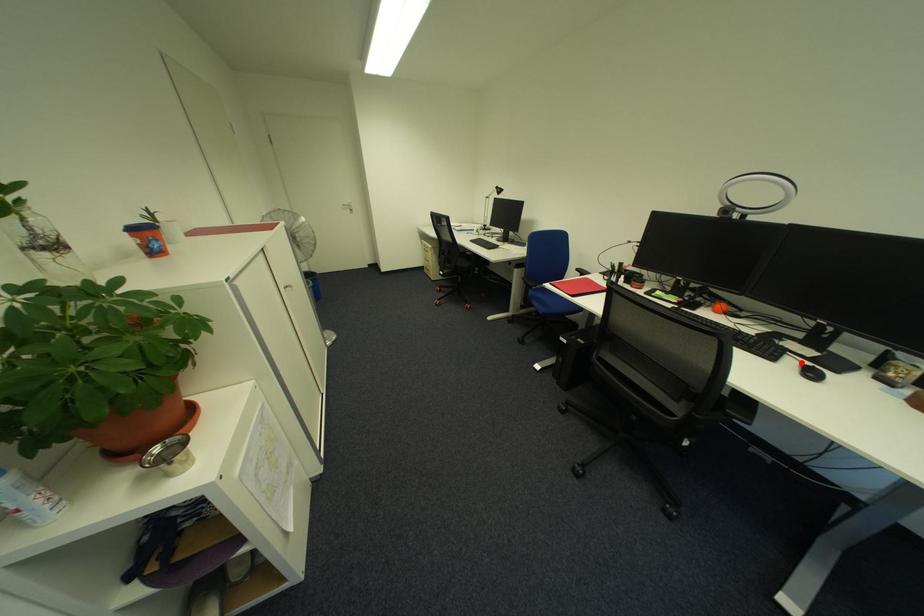
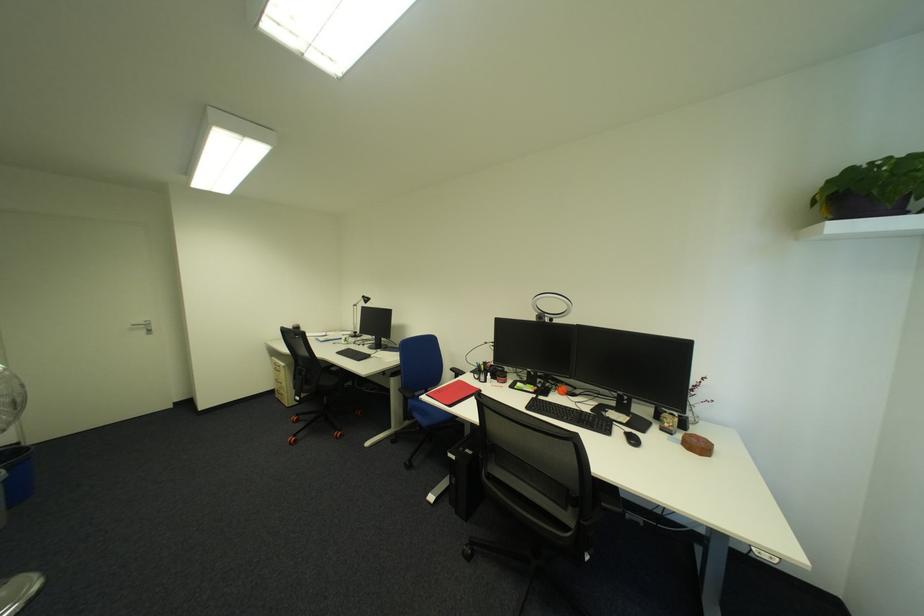
Where in the second image is the point corresponding to the highlighted location from the first image?

(628, 432)